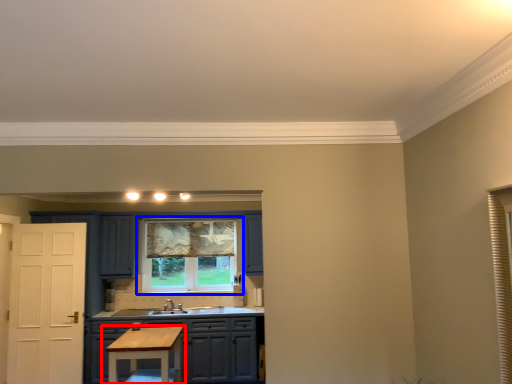
Question: Which of the following is the farthest to the observer, table (highlighted by a red box) or window (highlighted by a blue box)?

Choices:
 (A) table
 (B) window

Answer: (B)